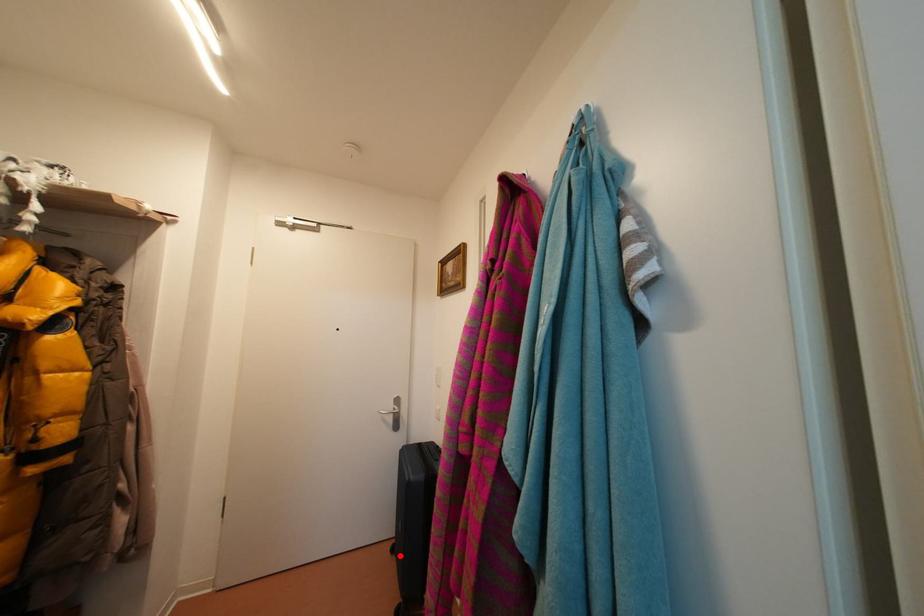
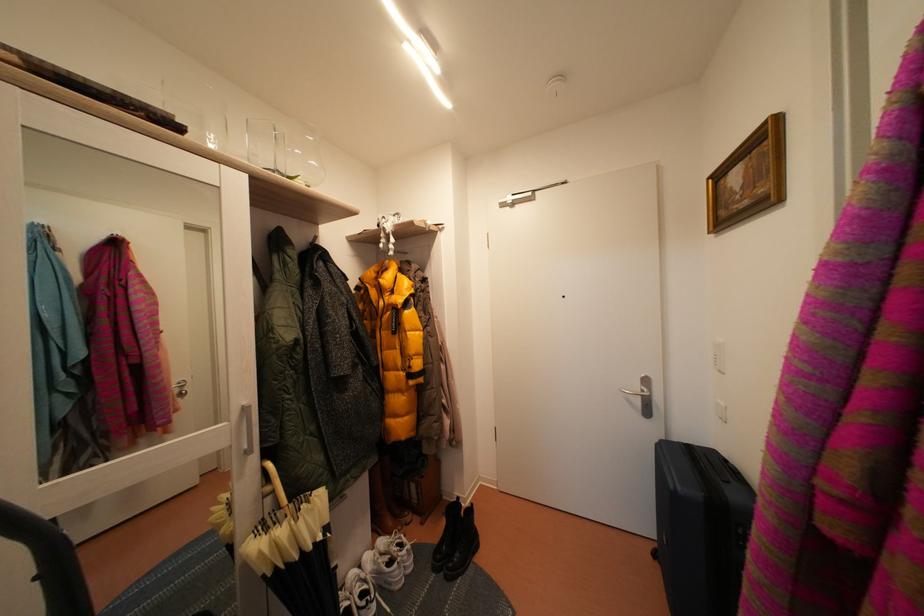
Question: A red point is marked in image1. In image2, is the corresponding 3D point closer to the camera or farther? Reply with the corresponding letter.

Choices:
 (A) The corresponding 3D point is closer.
 (B) The corresponding 3D point is farther.

Answer: (A)